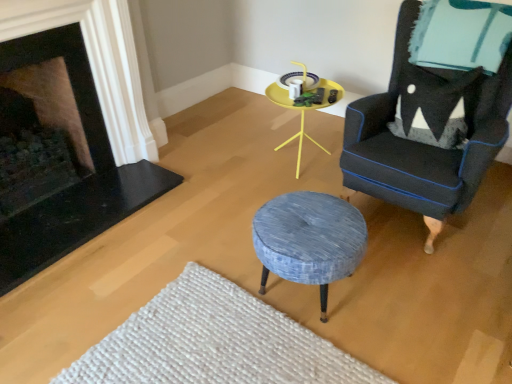
Question: Does yellow plastic table at center appear on the left side of black stone fireplace at left, marked as the first fireplace in a right-to-left arrangement?

Choices:
 (A) yes
 (B) no

Answer: (B)

Question: Does yellow plastic table at center appear on the right side of black stone fireplace at left, which is the 2th fireplace from left to right?

Choices:
 (A) no
 (B) yes

Answer: (B)

Question: From the image's perspective, is yellow plastic table at center located beneath black stone fireplace at left, marked as the first fireplace in a right-to-left arrangement?

Choices:
 (A) no
 (B) yes

Answer: (A)

Question: Does yellow plastic table at center have a greater width compared to black stone fireplace at left, which is the 2th fireplace from left to right?

Choices:
 (A) yes
 (B) no

Answer: (A)

Question: Is yellow plastic table at center far from black stone fireplace at left, which is the 2th fireplace from left to right?

Choices:
 (A) no
 (B) yes

Answer: (B)

Question: Based on their positions, is black stone fireplace at left, marked as the first fireplace in a right-to-left arrangement, located to the left or right of textured blue fabric stool at center?

Choices:
 (A) left
 (B) right

Answer: (A)

Question: Considering their positions, is black stone fireplace at left, which is the 2th fireplace from left to right, located in front of or behind textured blue fabric stool at center?

Choices:
 (A) behind
 (B) front

Answer: (A)

Question: Which is correct: black stone fireplace at left, which is the 2th fireplace from left to right, is inside textured blue fabric stool at center, or outside of it?

Choices:
 (A) inside
 (B) outside

Answer: (B)

Question: In terms of width, does black stone fireplace at left, marked as the first fireplace in a right-to-left arrangement, look wider or thinner when compared to textured blue fabric stool at center?

Choices:
 (A) thin
 (B) wide

Answer: (A)

Question: Is black stone fireplace at left, arranged as the second fireplace when viewed from the right, wider or thinner than black stone fireplace at left, which is the 2th fireplace from left to right?

Choices:
 (A) thin
 (B) wide

Answer: (B)

Question: Is black stone fireplace at left, arranged as the second fireplace when viewed from the right, to the left or to the right of black stone fireplace at left, marked as the first fireplace in a right-to-left arrangement, in the image?

Choices:
 (A) left
 (B) right

Answer: (A)

Question: Is point (62, 122) positioned closer to the camera than point (68, 223)?

Choices:
 (A) farther
 (B) closer

Answer: (A)

Question: From a real-world perspective, is black stone fireplace at left, arranged as the second fireplace when viewed from the right, positioned above or below black stone fireplace at left, marked as the first fireplace in a right-to-left arrangement?

Choices:
 (A) above
 (B) below

Answer: (B)

Question: Considering the positions of velvet dark blue armchair at right and black stone fireplace at left, acting as the first fireplace starting from the left, in the image, is velvet dark blue armchair at right bigger or smaller than black stone fireplace at left, acting as the first fireplace starting from the left,?

Choices:
 (A) small
 (B) big

Answer: (B)

Question: Looking at their shapes, would you say velvet dark blue armchair at right is wider or thinner than black stone fireplace at left, acting as the first fireplace starting from the left?

Choices:
 (A) thin
 (B) wide

Answer: (B)